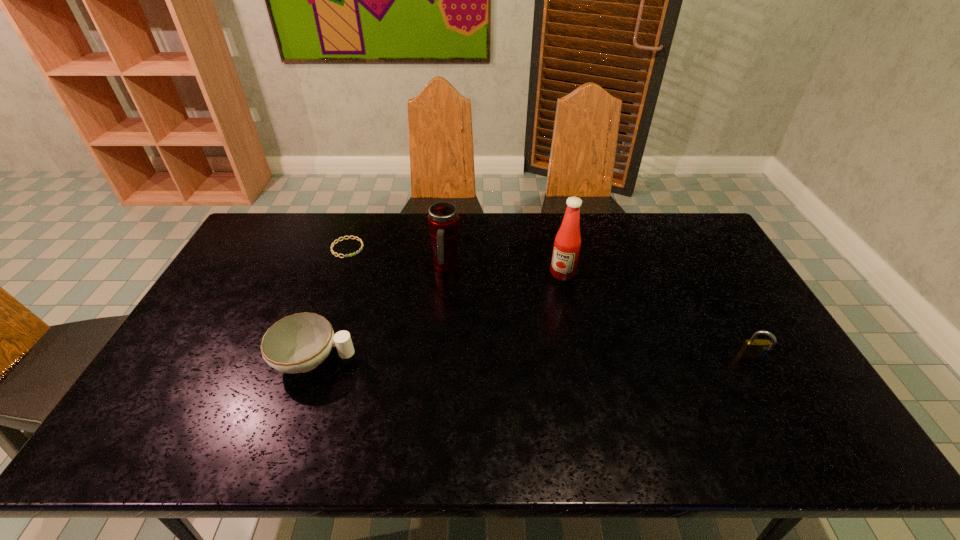
This screenshot has height=540, width=960. Identify the location of free space located on the side with the handle of the thermos bottle. (x=500, y=323).

Where is `free space located 0.110m on the side with the handle of the thermos bottle`? The width and height of the screenshot is (960, 540). free space located 0.110m on the side with the handle of the thermos bottle is located at coordinates (474, 298).

Locate an element on the screen. This screenshot has width=960, height=540. vacant space located 0.250m on the surface of the bracelet showing star-shaped elements is located at coordinates (396, 294).

At what (x,y) coordinates should I click in order to perform the action: click on blank space located on the surface of the bracelet showing star-shaped elements. Please return your answer as a coordinate pair (x, y). This screenshot has height=540, width=960. Looking at the image, I should click on (384, 282).

You are a GUI agent. You are given a task and a screenshot of the screen. Output one action in this format:
    pyautogui.click(x=<x>, y=<y>)
    Task: Click on the vacant space located 0.180m on the surface of the bracelet showing star-shaped elements
    
    Given the screenshot: What is the action you would take?
    tap(384, 282)

Find the location of `vacant area located on the front-facing side of the condiment`. vacant area located on the front-facing side of the condiment is located at coordinates coord(508,360).

In order to click on vacant position located 0.320m on the front-facing side of the condiment in this screenshot , I will do `click(515, 350)`.

You are a GUI agent. You are given a task and a screenshot of the screen. Output one action in this format:
    pyautogui.click(x=<x>, y=<y>)
    Task: Click on the free space located 0.220m on the front-facing side of the condiment
    
    Given the screenshot: What is the action you would take?
    pyautogui.click(x=529, y=326)

Locate an element on the screen. The width and height of the screenshot is (960, 540). object at the far edge is located at coordinates (358, 239).

At what (x,y) coordinates should I click in order to perform the action: click on object present at the near edge. Please return your answer as a coordinate pair (x, y). Looking at the image, I should click on (298, 343).